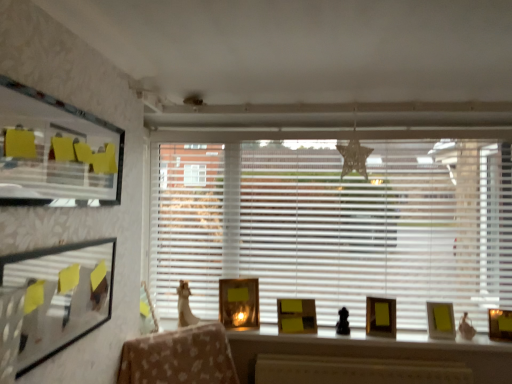
Image resolution: width=512 pixels, height=384 pixels. I want to click on vacant space that's between matte gold picture frame at right, placed as the third picture frame when sorted from back to front, and matte gold picture frame at center, the 3th picture frame from the right, so click(417, 337).